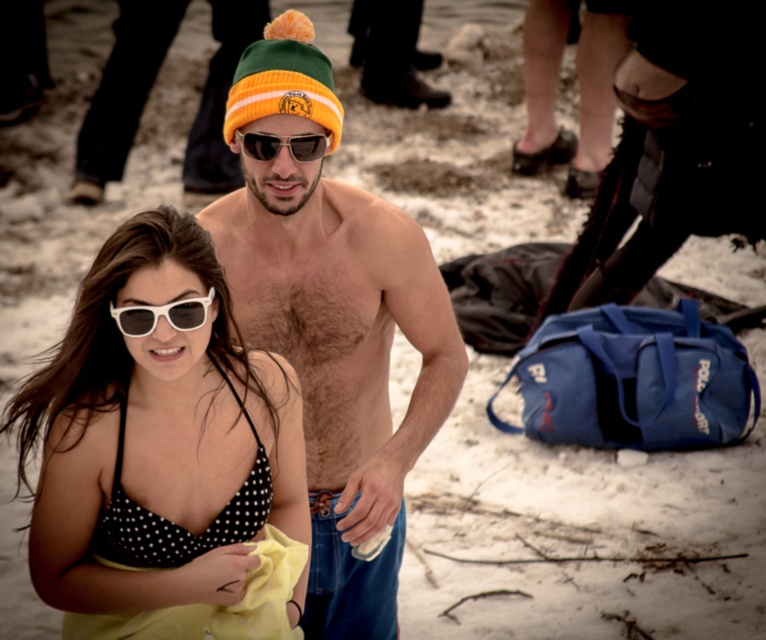
You are a photographer trying to capture a closeup of the woman in the foreground. You notice two points marked in the image at coordinates point (246, 605) and point (136, 321). Which point should you focus on to ensure the woman is in sharp focus?

You should focus on point (246, 605) because it is closer to the camera than point (136, 321), ensuring the woman in the foreground is in sharp focus.

You are standing in a snowy environment and see a point marked at coordinates (x=254, y=241). If you want to place a 3.5 meter long snowboard there, will it fit without overlapping the man or woman?

The point at (x=254, y=241) is 4.14 meters away from the viewer. Since the snowboard is 3.5 meters long, it can fit there without overlapping the man or woman as there is enough space.